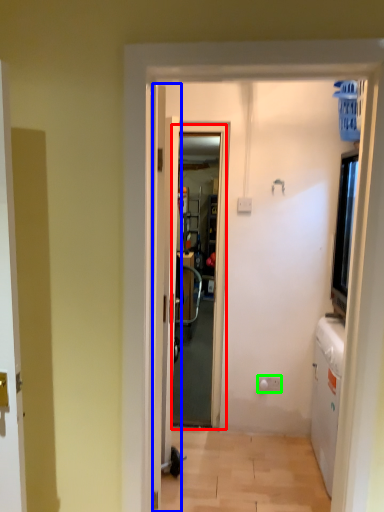
Question: Which object is the closest to the screen door (highlighted by a red box)? Choose among these: door (highlighted by a blue box) or electric outlet (highlighted by a green box).

Choices:
 (A) door
 (B) electric outlet

Answer: (A)